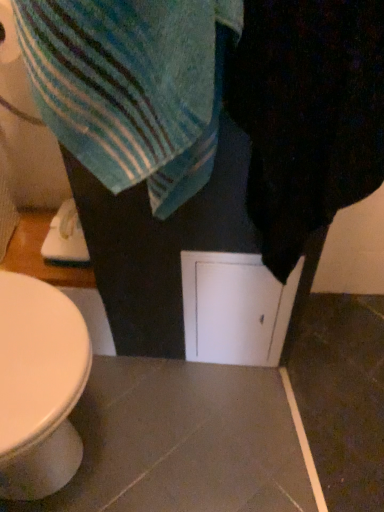
Locate an element on the screen. This screenshot has height=512, width=384. white matte screen door at center is located at coordinates (235, 308).

At what (x,y) coordinates should I click in order to perform the action: click on white matte screen door at center. Please return your answer as a coordinate pair (x, y). The image size is (384, 512). Looking at the image, I should click on (235, 308).

Does black fuzzy towel at right touch blue striped towel at upper left?

No, black fuzzy towel at right is not touching blue striped towel at upper left.

How different are the orientations of black fuzzy towel at right and blue striped towel at upper left in degrees?

The facing directions of black fuzzy towel at right and blue striped towel at upper left are 0.000375 degrees apart.

Is blue striped towel at upper left completely or partially inside black fuzzy towel at right?

No, blue striped towel at upper left is not surrounded by black fuzzy towel at right.

Is black fuzzy towel at right to the right of blue striped towel at upper left from the viewer's perspective?

Yes.

Do you think blue striped towel at upper left is within black fuzzy towel at right, or outside of it?

blue striped towel at upper left is outside black fuzzy towel at right.

Which object is closer to the camera, blue striped towel at upper left or black fuzzy towel at right?

Positioned in front is black fuzzy towel at right.

Where is `bath towel below the blue striped towel at upper left (from the image's perspective)`? The image size is (384, 512). bath towel below the blue striped towel at upper left (from the image's perspective) is located at coordinates (308, 115).

How different are the orientations of blue striped towel at upper left and black fuzzy towel at right in degrees?

There is a 0.000375-degree angle between the facing directions of blue striped towel at upper left and black fuzzy towel at right.

Is black fuzzy towel at right taller or shorter than white matte screen door at center?

Considering their sizes, black fuzzy towel at right has more height than white matte screen door at center.

Considering the sizes of black fuzzy towel at right and white matte screen door at center in the image, is black fuzzy towel at right bigger or smaller than white matte screen door at center?

Considering their sizes, black fuzzy towel at right takes up more space than white matte screen door at center.

Would you say black fuzzy towel at right is a long distance from white matte screen door at center?

No.

How much distance is there between black fuzzy towel at right and white matte screen door at center?

black fuzzy towel at right is 11.30 inches away from white matte screen door at center.

Considering the relative positions of white matte screen door at center and black fuzzy towel at right in the image provided, is white matte screen door at center to the left of black fuzzy towel at right from the viewer's perspective?

Indeed, white matte screen door at center is positioned on the left side of black fuzzy towel at right.

Which is behind, white matte screen door at center or black fuzzy towel at right?

white matte screen door at center is further from the camera.

Identify the location of screen door on the left of black fuzzy towel at right. (x=235, y=308).

Considering the positions of point (225, 319) and point (318, 49), is point (225, 319) closer or farther from the camera than point (318, 49)?

Point (225, 319) is farther from the camera than point (318, 49).

Is blue striped towel at upper left directly adjacent to white matte screen door at center?

blue striped towel at upper left is not next to white matte screen door at center, and they're not touching.

Is the depth of blue striped towel at upper left greater than that of white matte screen door at center?

No, blue striped towel at upper left is closer to the viewer.

From a real-world perspective, is blue striped towel at upper left beneath white matte screen door at center?

Actually, blue striped towel at upper left is physically above white matte screen door at center in the real world.

Which is in front, point (172, 166) or point (204, 325)?

The point (172, 166) is closer to the camera.

Is the surface of white matte screen door at center in direct contact with blue striped towel at upper left?

No, white matte screen door at center is not touching blue striped towel at upper left.

Considering the sizes of objects white matte screen door at center and blue striped towel at upper left in the image provided, who is taller, white matte screen door at center or blue striped towel at upper left?

Standing taller between the two is white matte screen door at center.

Is the position of white matte screen door at center less distant than that of blue striped towel at upper left?

No.

Which is in front, point (284, 309) or point (204, 45)?

The point (204, 45) is closer.

The height and width of the screenshot is (512, 384). In order to click on beach towel behind the black fuzzy towel at right in this screenshot , I will do `click(132, 86)`.

Find the location of a particular element. beach towel above the black fuzzy towel at right (from the image's perspective) is located at coordinates (132, 86).

When comparing their distances from blue striped towel at upper left, does white matte screen door at center or black fuzzy towel at right seem further?

Among the two, white matte screen door at center is located further to blue striped towel at upper left.

Looking at the image, which one is located closer to black fuzzy towel at right, blue striped towel at upper left or white matte screen door at center?

blue striped towel at upper left lies closer to black fuzzy towel at right than the other object.

From the image, which object appears to be nearer to black fuzzy towel at right, white matte screen door at center or blue striped towel at upper left?

Among the two, blue striped towel at upper left is located nearer to black fuzzy towel at right.

Looking at the image, which one is located further to white matte screen door at center, blue striped towel at upper left or black fuzzy towel at right?

blue striped towel at upper left is positioned further to the anchor white matte screen door at center.

From the image, which object appears to be nearer to blue striped towel at upper left, black fuzzy towel at right or white matte screen door at center?

black fuzzy towel at right is positioned closer to the anchor blue striped towel at upper left.

From the image, which object appears to be nearer to white matte screen door at center, black fuzzy towel at right or blue striped towel at upper left?

Among the two, black fuzzy towel at right is located nearer to white matte screen door at center.

You are a GUI agent. You are given a task and a screenshot of the screen. Output one action in this format:
    pyautogui.click(x=<x>, y=<y>)
    Task: Click on the beach towel between black fuzzy towel at right and white matte screen door at center along the z-axis
    
    Given the screenshot: What is the action you would take?
    click(x=132, y=86)